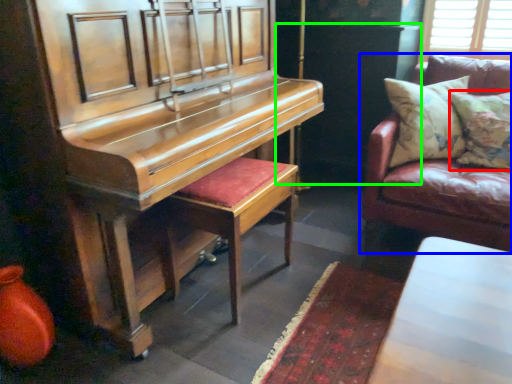
Question: Considering the real-world distances, which object is closest to pillow (highlighted by a red box)? studio couch (highlighted by a blue box) or dark (highlighted by a green box).

Choices:
 (A) studio couch
 (B) dark

Answer: (A)